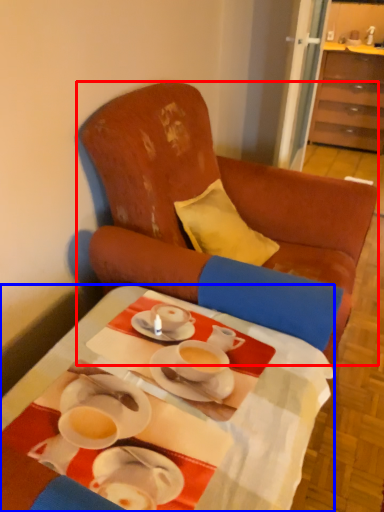
Question: Which point is further to the camera, chair (highlighted by a red box) or desk (highlighted by a blue box)?

Choices:
 (A) chair
 (B) desk

Answer: (A)